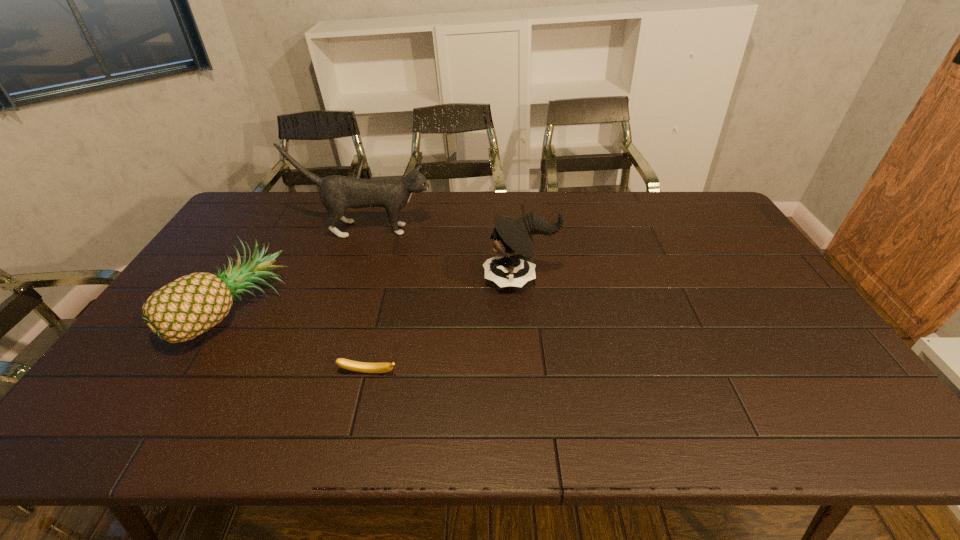
At what (x,y) coordinates should I click in order to perform the action: click on object that can be found as the closest to the second tallest object. Please return your answer as a coordinate pair (x, y). Image resolution: width=960 pixels, height=540 pixels. Looking at the image, I should click on pos(337,193).

This screenshot has width=960, height=540. I want to click on free spot that satisfies the following two spatial constraints: 1. at the face of the tallest object; 2. on the front side of the pineapple, so click(x=338, y=313).

This screenshot has width=960, height=540. Identify the location of vacant space that satisfies the following two spatial constraints: 1. at the face of the tallest object; 2. on the front side of the third tallest object. point(338,313).